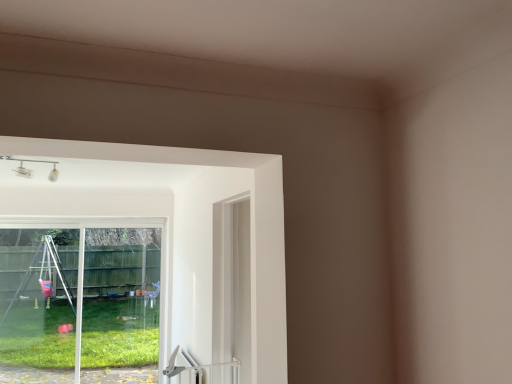
In order to face transparent glass window at lower left, should I rotate leftwards or rightwards?

Turn left by 22.146 degrees to look at transparent glass window at lower left.

What is the approximate height of transparent glass window at lower left?

transparent glass window at lower left is 1.88 meters tall.

This screenshot has width=512, height=384. Describe the element at coordinates (79, 300) in the screenshot. I see `transparent glass window at lower left` at that location.

I want to click on transparent glass window at lower left, so click(79, 300).

Identify the location of white plastic door handle at lower center. (182, 366).

Image resolution: width=512 pixels, height=384 pixels. What do you see at coordinates (182, 366) in the screenshot?
I see `white plastic door handle at lower center` at bounding box center [182, 366].

You are a GUI agent. You are given a task and a screenshot of the screen. Output one action in this format:
    pyautogui.click(x=<x>, y=<y>)
    Task: Click on the transparent glass window at lower left
    This screenshot has width=512, height=384.
    Given the screenshot: What is the action you would take?
    pyautogui.click(x=79, y=300)

Between white plastic door handle at lower center and transparent glass window at lower left, which one appears on the left side from the viewer's perspective?

From the viewer's perspective, transparent glass window at lower left appears more on the left side.

Which is in front, white plastic door handle at lower center or transparent glass window at lower left?

white plastic door handle at lower center.

Considering the points (180, 366) and (33, 368), which point is behind, point (180, 366) or point (33, 368)?

Positioned behind is point (33, 368).

From the image's perspective, is white plastic door handle at lower center located beneath transparent glass window at lower left?

Yes, from the image's perspective, white plastic door handle at lower center is beneath transparent glass window at lower left.

From a real-world perspective, which object rests below the other?

In real-world perspective, white plastic door handle at lower center is lower.

In terms of width, does white plastic door handle at lower center look wider or thinner when compared to transparent glass window at lower left?

Considering their sizes, white plastic door handle at lower center looks broader than transparent glass window at lower left.

Between white plastic door handle at lower center and transparent glass window at lower left, which one has less height?

white plastic door handle at lower center.

Considering the relative sizes of white plastic door handle at lower center and transparent glass window at lower left in the image provided, is white plastic door handle at lower center bigger than transparent glass window at lower left?

No, white plastic door handle at lower center is not bigger than transparent glass window at lower left.

Is transparent glass window at lower left surrounded by white plastic door handle at lower center?

No, transparent glass window at lower left is located outside of white plastic door handle at lower center.

Is white plastic door handle at lower center far away from transparent glass window at lower left?

That's right, there is a large distance between white plastic door handle at lower center and transparent glass window at lower left.

Could you tell me if white plastic door handle at lower center is facing transparent glass window at lower left?

No, white plastic door handle at lower center is not oriented towards transparent glass window at lower left.

Based on the photo, measure the distance between white plastic door handle at lower center and transparent glass window at lower left.

The distance of white plastic door handle at lower center from transparent glass window at lower left is 8.75 feet.

What are the coordinates of `door handle that is in front of the transparent glass window at lower left` in the screenshot? It's located at (182, 366).

Is transparent glass window at lower left to the left of white plastic door handle at lower center from the viewer's perspective?

Indeed, transparent glass window at lower left is positioned on the left side of white plastic door handle at lower center.

Between transparent glass window at lower left and white plastic door handle at lower center, which one is positioned behind?

Positioned behind is transparent glass window at lower left.

Which point is more forward, (132, 238) or (176, 371)?

The point (176, 371) is closer to the camera.

From the image's perspective, between transparent glass window at lower left and white plastic door handle at lower center, who is located below?

white plastic door handle at lower center, from the image's perspective.

From a real-world perspective, is transparent glass window at lower left physically below white plastic door handle at lower center?

No, from a real-world perspective, transparent glass window at lower left is not under white plastic door handle at lower center.

Considering the relative sizes of transparent glass window at lower left and white plastic door handle at lower center in the image provided, is transparent glass window at lower left wider than white plastic door handle at lower center?

In fact, transparent glass window at lower left might be narrower than white plastic door handle at lower center.

Considering the relative sizes of transparent glass window at lower left and white plastic door handle at lower center in the image provided, is transparent glass window at lower left taller than white plastic door handle at lower center?

Yes.

Considering the sizes of objects transparent glass window at lower left and white plastic door handle at lower center in the image provided, who is bigger, transparent glass window at lower left or white plastic door handle at lower center?

transparent glass window at lower left is bigger.

In the scene shown: Is transparent glass window at lower left situated inside white plastic door handle at lower center or outside?

transparent glass window at lower left is not enclosed by white plastic door handle at lower center.

Is transparent glass window at lower left positioned far away from white plastic door handle at lower center?

Yes.

Is transparent glass window at lower left facing away from white plastic door handle at lower center?

transparent glass window at lower left does not have its back to white plastic door handle at lower center.

How many degrees apart are the facing directions of transparent glass window at lower left and white plastic door handle at lower center?

The angle between the facing direction of transparent glass window at lower left and the facing direction of white plastic door handle at lower center is 90 degrees.

Image resolution: width=512 pixels, height=384 pixels. Identify the location of window positioned vertically above the white plastic door handle at lower center (from a real-world perspective). (79, 300).

Identify the location of window above the white plastic door handle at lower center (from a real-world perspective). Image resolution: width=512 pixels, height=384 pixels. tap(79, 300).

Identify the location of door handle on the right of transparent glass window at lower left. The height and width of the screenshot is (384, 512). (182, 366).